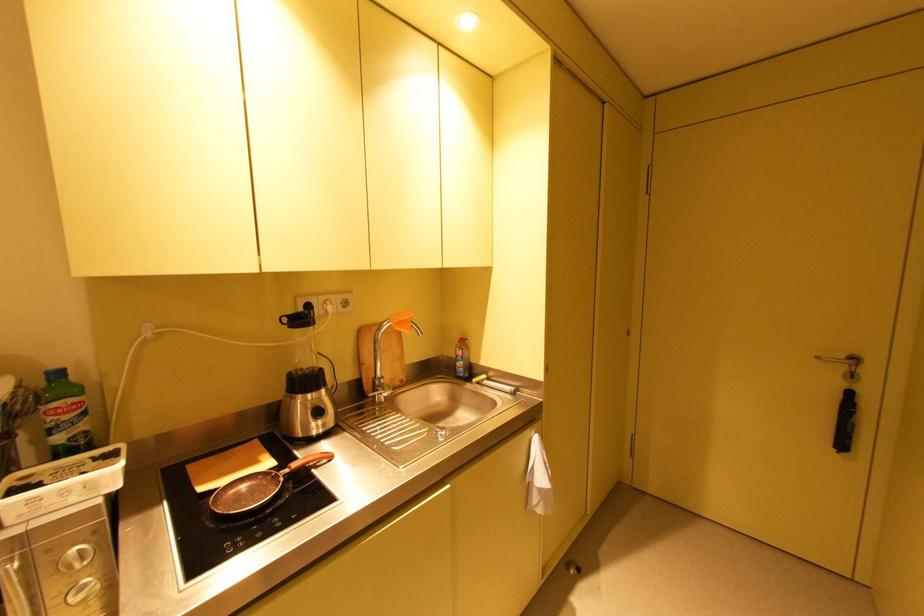
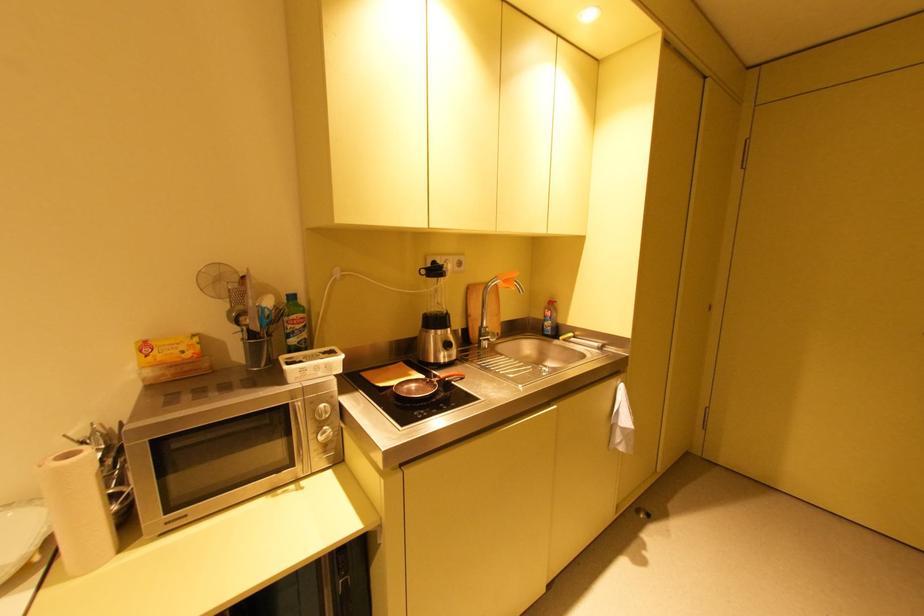
Where in the second image is the point corresponding to (x=254, y=488) from the first image?

(420, 387)